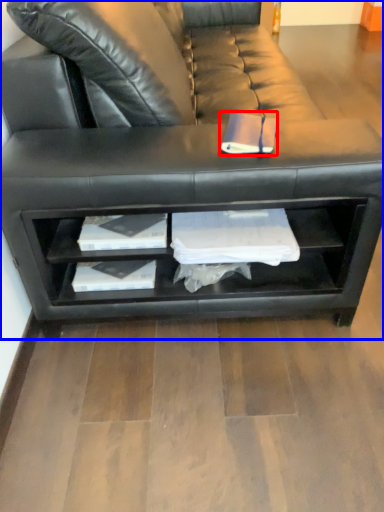
Question: Among these objects, which one is farthest to the camera, book (highlighted by a red box) or studio couch (highlighted by a blue box)?

Choices:
 (A) book
 (B) studio couch

Answer: (A)